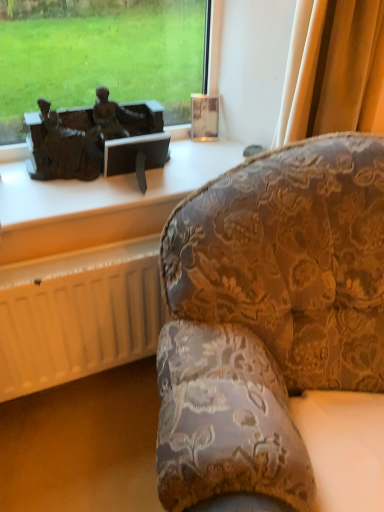
I want to click on vacant space situated above matte bronze sculpture at upper left (from a real-world perspective), so click(x=114, y=175).